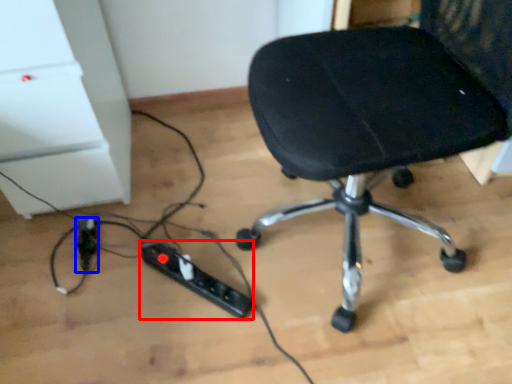
Question: Which point is further to the camera, extension cord (highlighted by a red box) or extension cord (highlighted by a blue box)?

Choices:
 (A) extension cord
 (B) extension cord

Answer: (B)